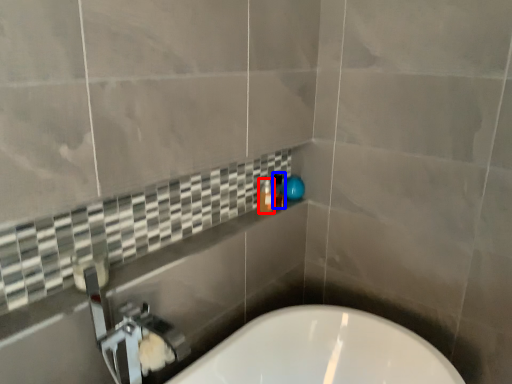
Question: Which point is closer to the camera, bottle (highlighted by a red box) or toiletry (highlighted by a blue box)?

Choices:
 (A) bottle
 (B) toiletry

Answer: (A)